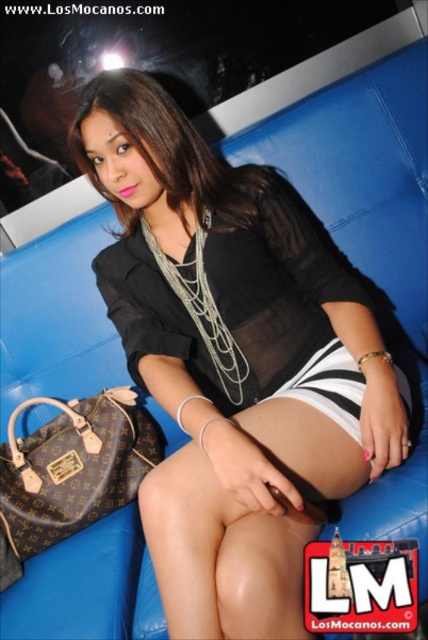
Question: Is black sheer dress at center to the left of brown leather handbag at lower left from the viewer's perspective?

Choices:
 (A) no
 (B) yes

Answer: (A)

Question: Which point is closer to the camera?

Choices:
 (A) black sheer blouse at center
 (B) brown leather handbag at lower left

Answer: (A)

Question: Can you confirm if black sheer dress at center is positioned to the left of black and white striped shorts at lower center?

Choices:
 (A) no
 (B) yes

Answer: (B)

Question: Estimate the real-world distances between objects in this image. Which object is farther from the brown leather handbag at lower left?

Choices:
 (A) black sheer blouse at center
 (B) black and white striped shorts at lower center
 (C) black sheer dress at center

Answer: (B)

Question: Is the position of black sheer dress at center less distant than that of brown leather handbag at lower left?

Choices:
 (A) yes
 (B) no

Answer: (A)

Question: Which point is closer to the camera?

Choices:
 (A) black sheer dress at center
 (B) black and white striped shorts at lower center

Answer: (B)